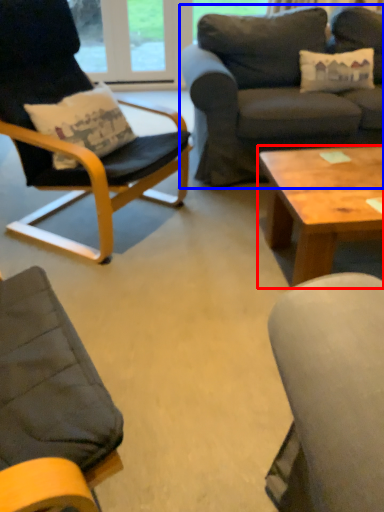
Question: Which object appears farthest to the camera in this image, coffee table (highlighted by a red box) or studio couch (highlighted by a blue box)?

Choices:
 (A) coffee table
 (B) studio couch

Answer: (B)